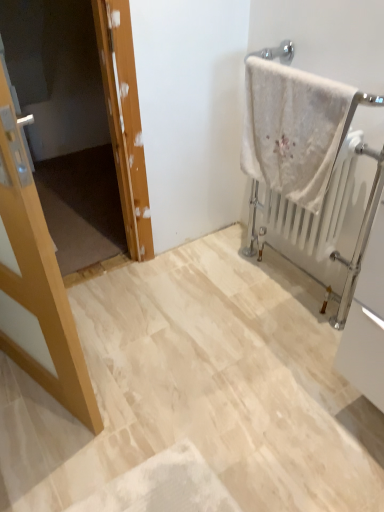
At what (x,y) coordinates should I click in order to perform the action: click on vacant space underneath white fluffy towel at upper right (from a real-world perspective). Please return your answer as a coordinate pair (x, y). Looking at the image, I should click on [264, 296].